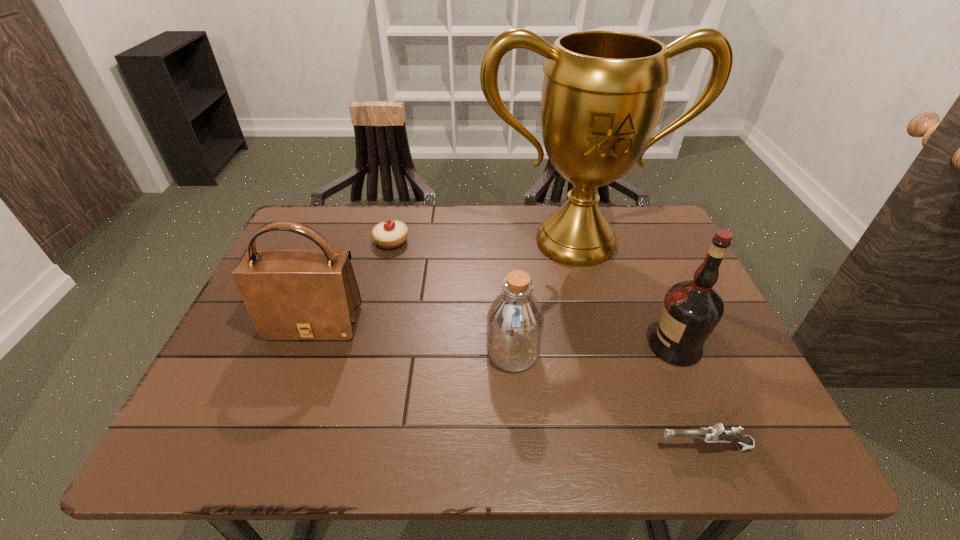
In the image, there is a desktop. Where is `vacant space at the near right corner`? vacant space at the near right corner is located at coordinates (700, 442).

The width and height of the screenshot is (960, 540). I want to click on empty space that is in between the shoulder bag and the bottle, so click(x=414, y=338).

What are the coordinates of `empty space between the bottle and the trophy cup` in the screenshot? It's located at (544, 296).

This screenshot has width=960, height=540. I want to click on free point between the third shortest object and the gun, so pyautogui.click(x=609, y=400).

I want to click on vacant region between the liquor and the bottle, so click(594, 349).

Locate an element on the screen. empty location between the nearest object and the shoulder bag is located at coordinates (509, 385).

This screenshot has height=540, width=960. Find the location of `free space between the shoulder bag and the trophy cup`. free space between the shoulder bag and the trophy cup is located at coordinates (444, 282).

Where is `unoccupied area between the trophy cup and the third shortest object`? unoccupied area between the trophy cup and the third shortest object is located at coordinates (544, 296).

At what (x,y) coordinates should I click in order to perform the action: click on vacant space that's between the pastry and the fourth tallest object. Please return your answer as a coordinate pair (x, y). The image size is (960, 540). Looking at the image, I should click on (452, 297).

Where is `object that is the fifth closest one to the shoulder bag`? object that is the fifth closest one to the shoulder bag is located at coordinates [x=691, y=310].